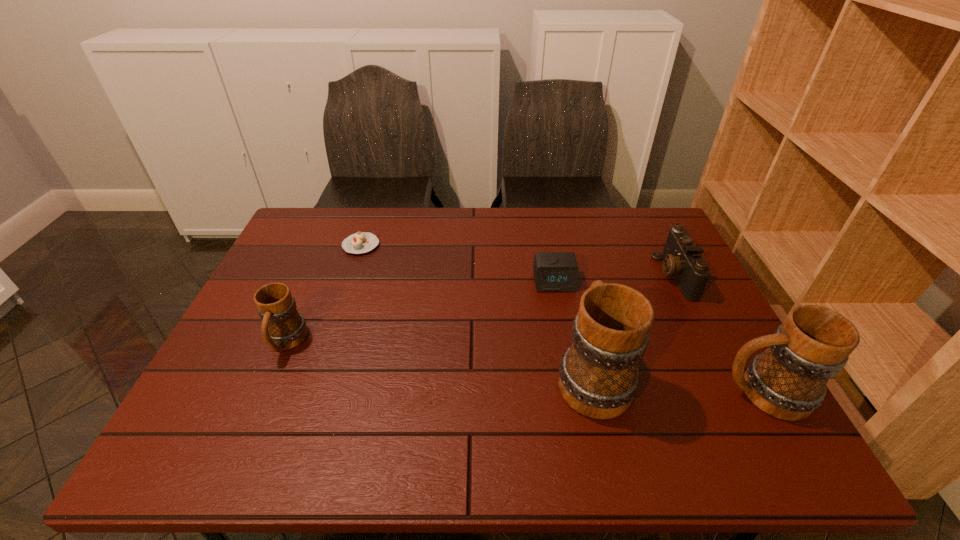
This screenshot has height=540, width=960. Find the location of `object present at the far edge`. object present at the far edge is located at coordinates (361, 242).

You are a GUI agent. You are given a task and a screenshot of the screen. Output one action in this format:
    pyautogui.click(x=<x>, y=<y>)
    Task: Click on the object that is at the left edge
    The height and width of the screenshot is (540, 960).
    Given the screenshot: What is the action you would take?
    pyautogui.click(x=283, y=327)

I want to click on mug that is at the right edge, so click(787, 381).

This screenshot has height=540, width=960. Identify the location of camera that is at the right edge. (682, 259).

Locate an element on the screen. object at the near right corner is located at coordinates (787, 381).

Identify the location of vacant space at the far edge of the desktop. This screenshot has height=540, width=960. (484, 222).

In the image, there is a desktop. Where is `free region at the near edge`? Image resolution: width=960 pixels, height=540 pixels. free region at the near edge is located at coordinates (671, 407).

Locate an element on the screen. vacant space at the right edge of the desktop is located at coordinates pos(658,281).

The width and height of the screenshot is (960, 540). Find the location of `vacant area at the far left corner`. vacant area at the far left corner is located at coordinates (303, 220).

Image resolution: width=960 pixels, height=540 pixels. What are the coordinates of `vacant area at the near left corner of the desktop` in the screenshot? It's located at (228, 396).